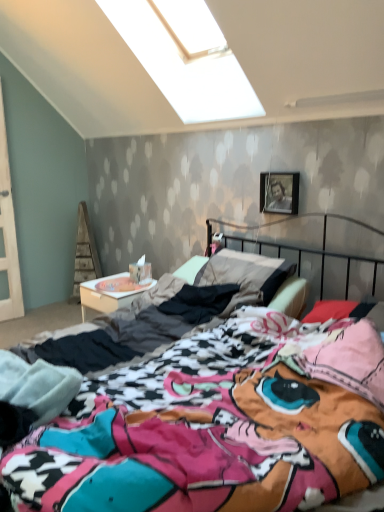
Question: Is multicolored fabric bed at center positioned far away from white cardboard at lower left?

Choices:
 (A) no
 (B) yes

Answer: (B)

Question: Is multicolored fabric bed at center behind white cardboard at lower left?

Choices:
 (A) no
 (B) yes

Answer: (A)

Question: Would you say multicolored fabric bed at center is outside white cardboard at lower left?

Choices:
 (A) yes
 (B) no

Answer: (A)

Question: From a real-world perspective, is multicolored fabric bed at center positioned under white cardboard at lower left based on gravity?

Choices:
 (A) no
 (B) yes

Answer: (A)

Question: Is multicolored fabric bed at center aimed at white cardboard at lower left?

Choices:
 (A) no
 (B) yes

Answer: (A)

Question: Is multicolored fabric bed at center in front of white cardboard at lower left?

Choices:
 (A) no
 (B) yes

Answer: (B)

Question: Is the position of metallic silver picture frame at upper right more distant than that of multicolored fabric bed at center?

Choices:
 (A) yes
 (B) no

Answer: (A)

Question: Is metallic silver picture frame at upper right to the left of multicolored fabric bed at center from the viewer's perspective?

Choices:
 (A) yes
 (B) no

Answer: (B)

Question: Is metallic silver picture frame at upper right facing away from multicolored fabric bed at center?

Choices:
 (A) yes
 (B) no

Answer: (B)

Question: Is metallic silver picture frame at upper right positioned beyond the bounds of multicolored fabric bed at center?

Choices:
 (A) yes
 (B) no

Answer: (A)

Question: Does metallic silver picture frame at upper right have a lesser width compared to multicolored fabric bed at center?

Choices:
 (A) yes
 (B) no

Answer: (A)

Question: Is multicolored fabric bed at center inside metallic silver picture frame at upper right?

Choices:
 (A) yes
 (B) no

Answer: (B)

Question: Would you say white cardboard at lower left is a long distance from multicolored fabric bed at center?

Choices:
 (A) no
 (B) yes

Answer: (B)